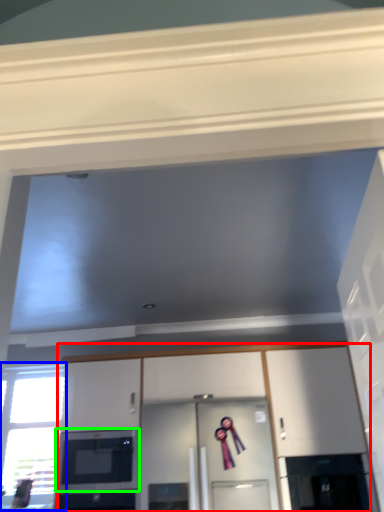
Question: Which object is the closest to the cabinetry (highlighted by a red box)? Choose among these: window (highlighted by a blue box) or microwave oven (highlighted by a green box).

Choices:
 (A) window
 (B) microwave oven

Answer: (B)